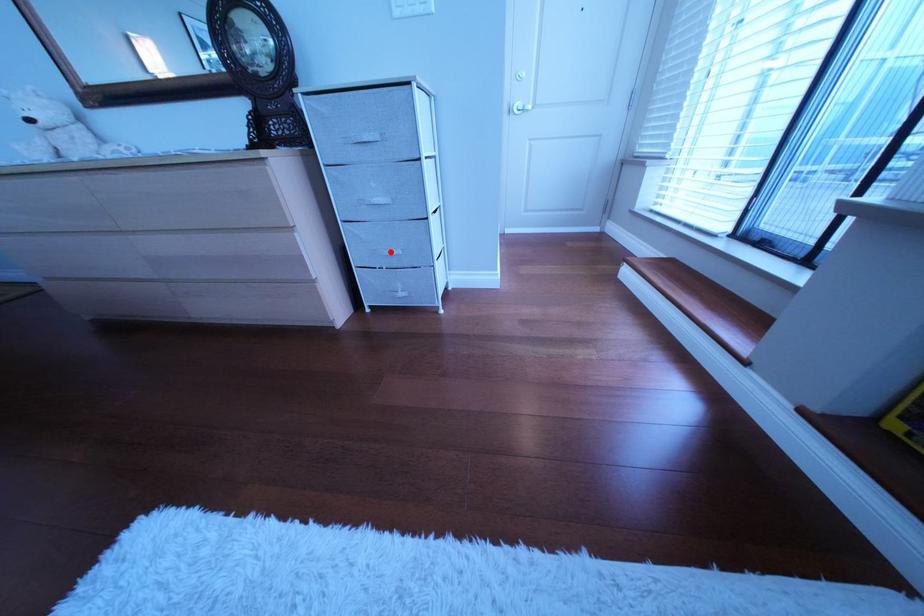
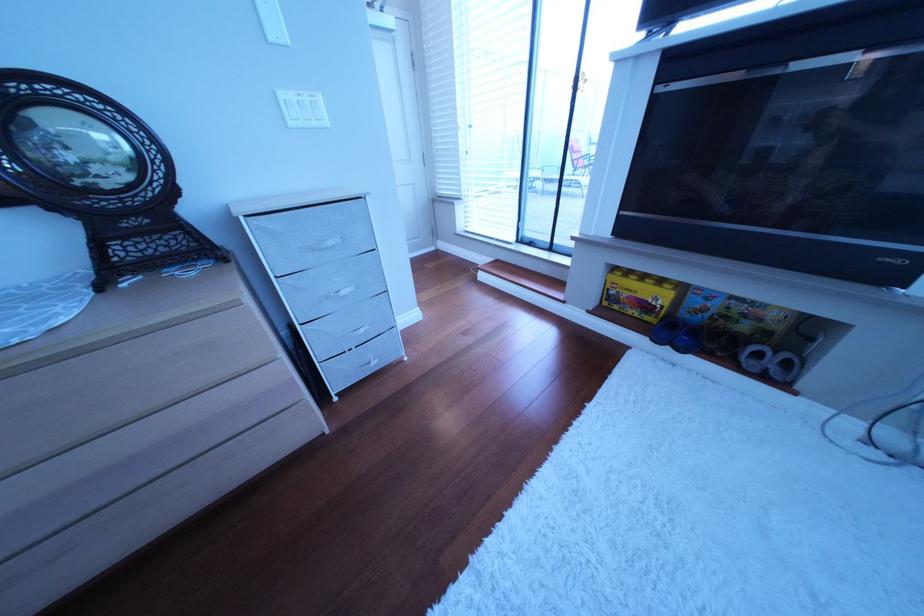
Find the pixel in the second image that matches the highlighted location in the first image.

(358, 339)